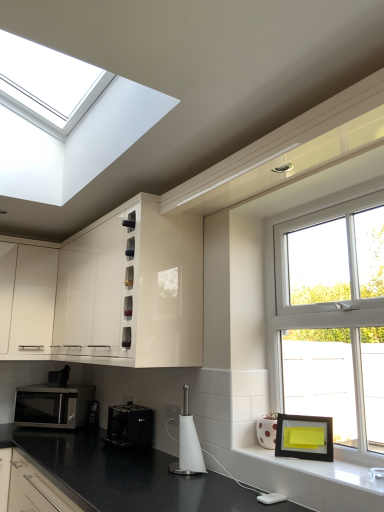
Question: Can you confirm if glossy white cabinet at upper center, which is the second cabinetry from left to right, is taller than white glossy electric outlet at center, acting as the first electric outlet starting from the right?

Choices:
 (A) no
 (B) yes

Answer: (B)

Question: Is glossy white cabinet at upper center, which is the second cabinetry from left to right, far away from white glossy electric outlet at center, the 2th electric outlet from the left?

Choices:
 (A) no
 (B) yes

Answer: (A)

Question: From the image's perspective, is glossy white cabinet at upper center, which is the first cabinetry in right-to-left order, under white glossy electric outlet at center, acting as the first electric outlet starting from the right?

Choices:
 (A) no
 (B) yes

Answer: (A)

Question: Is glossy white cabinet at upper center, which is the first cabinetry in right-to-left order, placed right next to white glossy electric outlet at center, the first electric outlet from the front?

Choices:
 (A) yes
 (B) no

Answer: (B)

Question: Is white glossy electric outlet at center, placed as the second electric outlet when sorted from bottom to top, at the back of glossy white cabinet at upper center, which is the first cabinetry in right-to-left order?

Choices:
 (A) no
 (B) yes

Answer: (A)

Question: Is glossy white cabinet at upper center, which is the second cabinetry from left to right, wider or thinner than white glossy window sill at lower right?

Choices:
 (A) thin
 (B) wide

Answer: (B)

Question: From their relative heights in the image, would you say glossy white cabinet at upper center, which is the first cabinetry in right-to-left order, is taller or shorter than white glossy window sill at lower right?

Choices:
 (A) tall
 (B) short

Answer: (A)

Question: From a real-world perspective, is glossy white cabinet at upper center, which is the second cabinetry from left to right, physically located above or below white glossy window sill at lower right?

Choices:
 (A) below
 (B) above

Answer: (B)

Question: Would you say glossy white cabinet at upper center, which is the second cabinetry from left to right, is to the left or to the right of white glossy window sill at lower right in the picture?

Choices:
 (A) right
 (B) left

Answer: (B)

Question: Considering the positions of black plastic toaster at lower center, placed as the 3th appliance when sorted from right to left, and white glossy electric outlet at center, the first electric outlet from the front, in the image, is black plastic toaster at lower center, placed as the 3th appliance when sorted from right to left, bigger or smaller than white glossy electric outlet at center, the first electric outlet from the front,?

Choices:
 (A) big
 (B) small

Answer: (A)

Question: Do you think black plastic toaster at lower center, placed as the 3th appliance when sorted from right to left, is within white glossy electric outlet at center, arranged as the 2th electric outlet when viewed from the back, or outside of it?

Choices:
 (A) outside
 (B) inside

Answer: (A)

Question: From a real-world perspective, is black plastic toaster at lower center, which is counted as the 1th appliance, starting from the back, positioned above or below white glossy electric outlet at center, acting as the first electric outlet starting from the right?

Choices:
 (A) above
 (B) below

Answer: (B)

Question: Is black plastic toaster at lower center, placed as the 3th appliance when sorted from right to left, taller or shorter than white glossy electric outlet at center, placed as the 1th electric outlet when sorted from top to bottom?

Choices:
 (A) tall
 (B) short

Answer: (A)

Question: Considering the positions of white paper towel holder at center, which appears as the 1th appliance when viewed from the front, and white glossy electric outlet at center, placed as the second electric outlet when sorted from bottom to top, in the image, is white paper towel holder at center, which appears as the 1th appliance when viewed from the front, bigger or smaller than white glossy electric outlet at center, placed as the second electric outlet when sorted from bottom to top,?

Choices:
 (A) small
 (B) big

Answer: (B)

Question: From a real-world perspective, is white paper towel holder at center, which appears as the 1th appliance when viewed from the front, above or below white glossy electric outlet at center, acting as the first electric outlet starting from the right?

Choices:
 (A) below
 (B) above

Answer: (A)